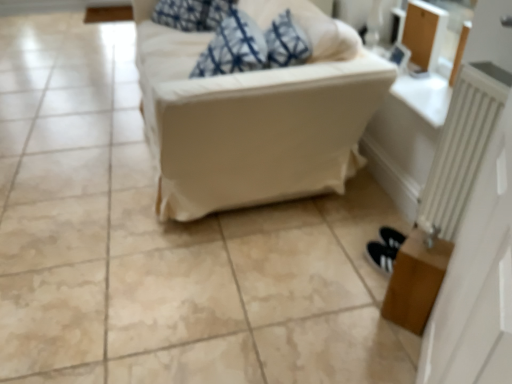
In order to click on free space that is to the left of brown wooden table at lower right in this screenshot , I will do `click(351, 310)`.